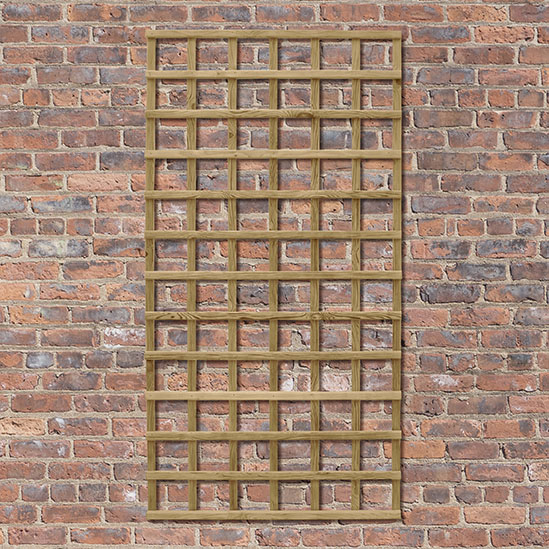
Locate an element on the screen. The height and width of the screenshot is (549, 549). corner is located at coordinates (149, 35), (397, 35), (396, 513), (151, 515).